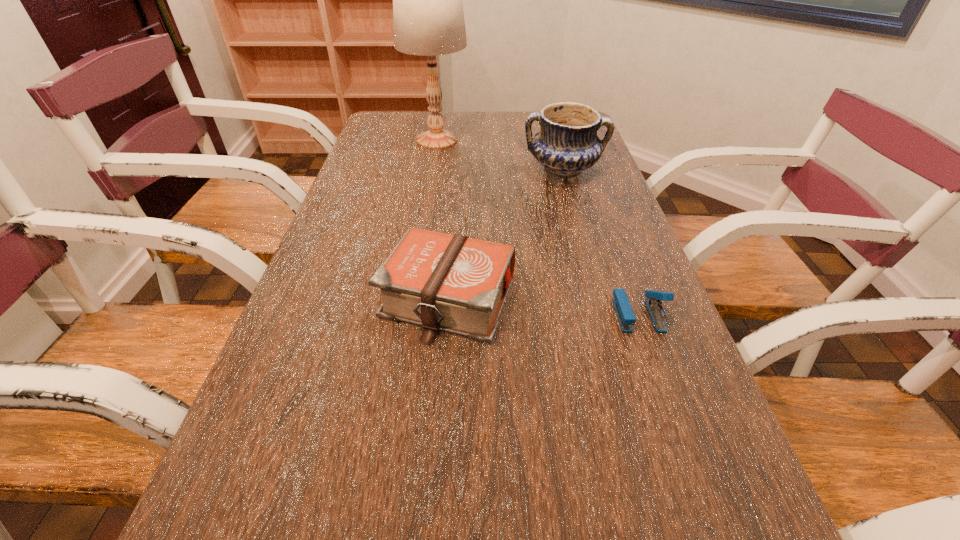
This screenshot has height=540, width=960. Identify the location of pottery at the right edge. (567, 143).

Where is `stapler present at the right edge`? This screenshot has width=960, height=540. stapler present at the right edge is located at coordinates (626, 318).

At what (x,y) coordinates should I click in order to perform the action: click on object positioned at the far left corner. Please return your answer as a coordinate pair (x, y). The width and height of the screenshot is (960, 540). Looking at the image, I should click on (428, 16).

In the image, there is a desktop. Identify the location of free space at the far edge. This screenshot has width=960, height=540. (508, 119).

Image resolution: width=960 pixels, height=540 pixels. In the image, there is a desktop. What are the coordinates of `vacant space at the left edge` in the screenshot? It's located at (244, 429).

I want to click on vacant area at the right edge of the desktop, so click(x=698, y=428).

In order to click on free area in between the pottery and the lamp in this screenshot , I will do tap(500, 155).

I want to click on free space that is in between the stapler and the tallest object, so click(538, 227).

Identify the location of vacant area between the third shortest object and the second shortest object. (506, 233).

The height and width of the screenshot is (540, 960). What are the coordinates of `free area in between the Bible and the tallest object` in the screenshot? It's located at pos(443,218).